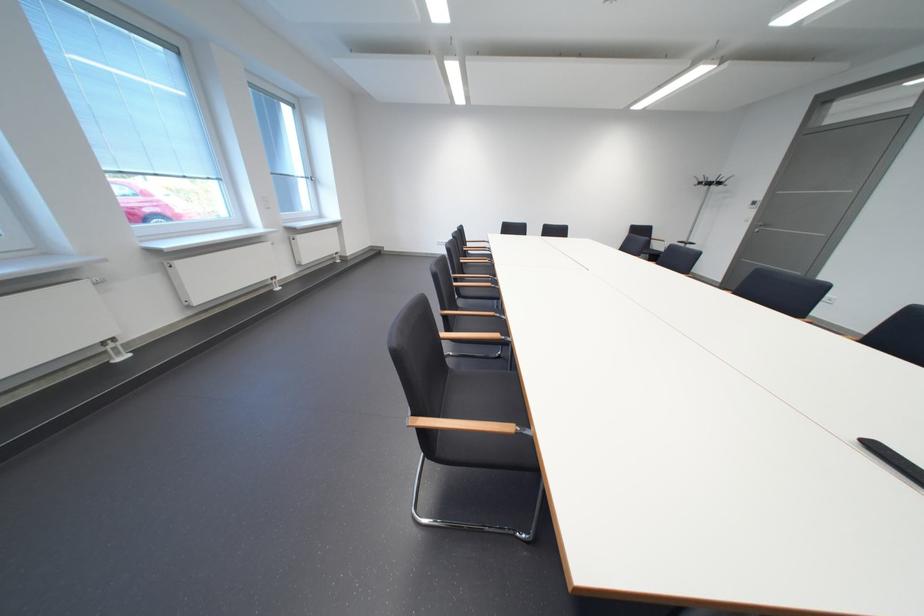
The width and height of the screenshot is (924, 616). What do you see at coordinates (466, 426) in the screenshot?
I see `the wooden chair armrest` at bounding box center [466, 426].